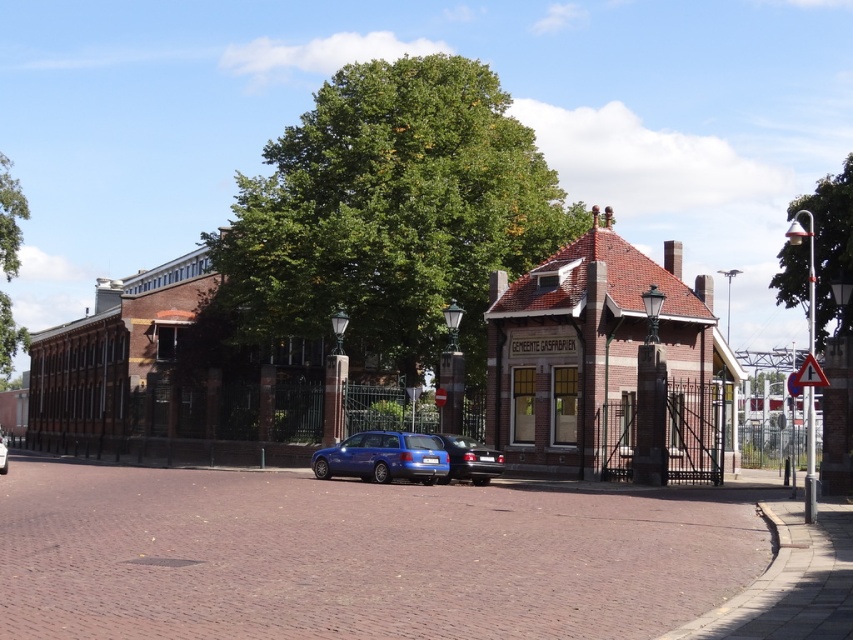
In the scene shown: You are standing at the point with coordinates (830, 246) in the image. What object is located at this point?

The green leafy tree at upper right is located at point (830, 246).

You are standing at the center of the cobblestone street in the European town scene. You see a small red brick building with a sign on the right and a larger industrial structure on the left. There is also a point marked at coordinates (392, 209). What object is located at that point?

The point at (392, 209) indicates a green leafy tree at center.